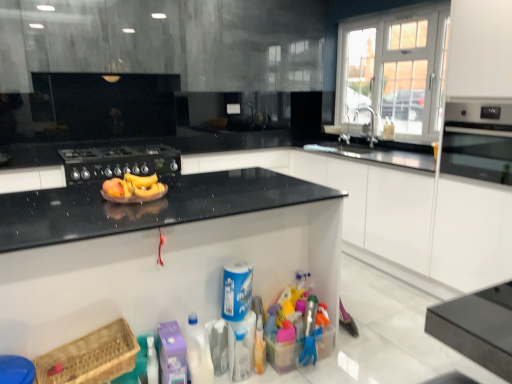
Question: Can you confirm if translucent plastic bottle at lower center is shorter than brown woven basket at lower left?

Choices:
 (A) no
 (B) yes

Answer: (A)

Question: Is translucent plastic bottle at lower center taller than brown woven basket at lower left?

Choices:
 (A) no
 (B) yes

Answer: (B)

Question: Can you confirm if translucent plastic bottle at lower center is positioned to the left of brown woven basket at lower left?

Choices:
 (A) yes
 (B) no

Answer: (B)

Question: From the image's perspective, is translucent plastic bottle at lower center located above brown woven basket at lower left?

Choices:
 (A) no
 (B) yes

Answer: (A)

Question: Does translucent plastic bottle at lower center appear on the right side of brown woven basket at lower left?

Choices:
 (A) yes
 (B) no

Answer: (A)

Question: Is translucent plastic bottle at lower center facing towards brown woven basket at lower left?

Choices:
 (A) yes
 (B) no

Answer: (B)

Question: Could you tell me if purple plastic container at lower center, which is the fourth cleaning product from right to left, is facing blue plastic canister at center, marked as the 2th cleaning product in a right-to-left arrangement?

Choices:
 (A) no
 (B) yes

Answer: (A)

Question: Considering the relative sizes of purple plastic container at lower center, which is the fourth cleaning product from right to left, and blue plastic canister at center, the 3th cleaning product from the left, in the image provided, is purple plastic container at lower center, which is the fourth cleaning product from right to left, bigger than blue plastic canister at center, the 3th cleaning product from the left,?

Choices:
 (A) yes
 (B) no

Answer: (A)

Question: Is purple plastic container at lower center, which is the fourth cleaning product from right to left, to the right of blue plastic canister at center, the 3th cleaning product from the left, from the viewer's perspective?

Choices:
 (A) yes
 (B) no

Answer: (B)

Question: Does purple plastic container at lower center, acting as the first cleaning product starting from the left, have a greater height compared to blue plastic canister at center, the 3th cleaning product from the left?

Choices:
 (A) no
 (B) yes

Answer: (B)

Question: Is purple plastic container at lower center, acting as the first cleaning product starting from the left, with blue plastic canister at center, the 3th cleaning product from the left?

Choices:
 (A) yes
 (B) no

Answer: (B)

Question: Is purple plastic container at lower center, which is the fourth cleaning product from right to left, smaller than blue plastic canister at center, marked as the 2th cleaning product in a right-to-left arrangement?

Choices:
 (A) yes
 (B) no

Answer: (B)

Question: Is yellow matte banana at center completely or partially outside of matte black oven at right?

Choices:
 (A) no
 (B) yes

Answer: (B)